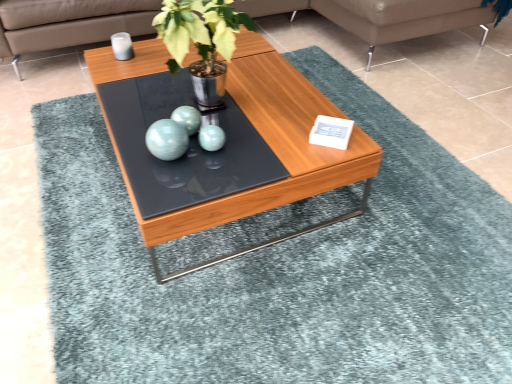
Where is `empty space that is to the right of teal glossy sphere at center`? empty space that is to the right of teal glossy sphere at center is located at coordinates (228, 156).